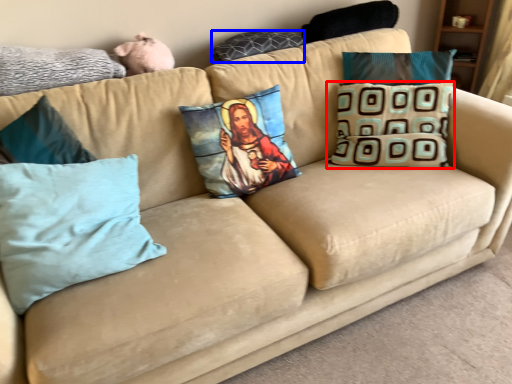
Question: Which object is further to the camera taking this photo, pillow (highlighted by a red box) or pillow (highlighted by a blue box)?

Choices:
 (A) pillow
 (B) pillow

Answer: (B)